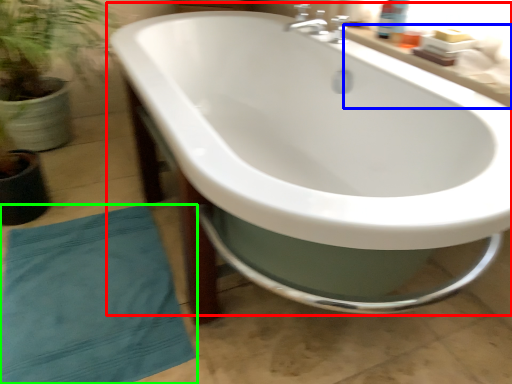
Question: Considering the real-world distances, which object is closest to bathtub (highlighted by a red box)? counter top (highlighted by a blue box) or beach towel (highlighted by a green box).

Choices:
 (A) counter top
 (B) beach towel

Answer: (A)